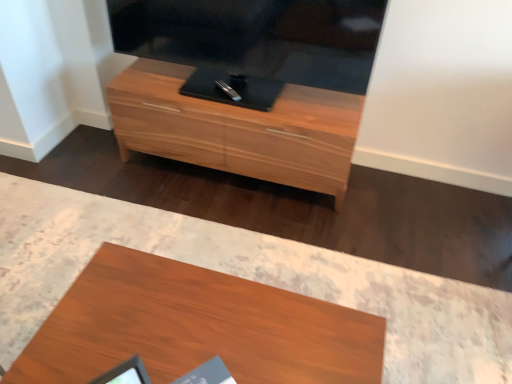
Identify the location of wooden chest of drawers at center. (238, 129).

The width and height of the screenshot is (512, 384). What do you see at coordinates (238, 129) in the screenshot?
I see `wooden chest of drawers at center` at bounding box center [238, 129].

Measure the distance between wooden chest of drawers at center and camera.

The distance of wooden chest of drawers at center from camera is 1.87 meters.

What is the approximate height of wooden desk at center?

wooden desk at center is 41.45 centimeters in height.

The image size is (512, 384). Describe the element at coordinates (196, 327) in the screenshot. I see `wooden desk at center` at that location.

Measure the distance between point (142,273) and camera.

They are 1.28 meters apart.

What are the coordinates of `wooden desk at center` in the screenshot? It's located at (196, 327).

At what (x,y) coordinates should I click in order to perform the action: click on wooden chest of drawers at center. Please return your answer as a coordinate pair (x, y). Looking at the image, I should click on (238, 129).

Which is more to the left, wooden chest of drawers at center or wooden desk at center?

wooden desk at center is more to the left.

Between wooden chest of drawers at center and wooden desk at center, which one is positioned behind?

wooden chest of drawers at center is more distant.

Looking at this image, which is further, (115,83) or (106,243)?

Point (115,83)

From the image's perspective, is wooden chest of drawers at center positioned above or below wooden desk at center?

Based on their image positions, wooden chest of drawers at center is located above wooden desk at center.

From a real-world perspective, is wooden chest of drawers at center below wooden desk at center?

No, from a real-world perspective, wooden chest of drawers at center is not beneath wooden desk at center.

Considering the relative sizes of wooden chest of drawers at center and wooden desk at center in the image provided, is wooden chest of drawers at center wider than wooden desk at center?

Incorrect, the width of wooden chest of drawers at center does not surpass that of wooden desk at center.

Does wooden chest of drawers at center have a greater height compared to wooden desk at center?

Indeed, wooden chest of drawers at center has a greater height compared to wooden desk at center.

Considering the sizes of objects wooden chest of drawers at center and wooden desk at center in the image provided, who is bigger, wooden chest of drawers at center or wooden desk at center?

wooden chest of drawers at center.

Is wooden desk at center located within wooden chest of drawers at center?

Definitely not — wooden desk at center is not inside wooden chest of drawers at center.

Is wooden chest of drawers at center beside wooden desk at center?

wooden chest of drawers at center and wooden desk at center are not in contact.

Is wooden chest of drawers at center positioned with its back to wooden desk at center?

No, wooden chest of drawers at center's orientation is not away from wooden desk at center.

What's the angular difference between wooden chest of drawers at center and wooden desk at center's facing directions?

They differ by 179 degrees in their facing directions.

Measure the distance between wooden chest of drawers at center and wooden desk at center.

A distance of 38.01 inches exists between wooden chest of drawers at center and wooden desk at center.

You are a GUI agent. You are given a task and a screenshot of the screen. Output one action in this format:
    pyautogui.click(x=<x>, y=<y>)
    Task: Click on the chest of drawers located behind the wooden desk at center
    
    Given the screenshot: What is the action you would take?
    pyautogui.click(x=238, y=129)

Visually, is wooden desk at center positioned to the left or to the right of wooden chest of drawers at center?

wooden desk at center is to the left of wooden chest of drawers at center.

Is wooden desk at center behind wooden chest of drawers at center?

No.

Considering the positions of points (260, 317) and (179, 102), is point (260, 317) farther from camera compared to point (179, 102)?

No, (260, 317) is in front of (179, 102).

From the image's perspective, is wooden desk at center under wooden chest of drawers at center?

Yes, from the image's perspective, wooden desk at center is below wooden chest of drawers at center.

From a real-world perspective, between wooden desk at center and wooden chest of drawers at center, who is vertically higher?

From a 3D spatial view, wooden chest of drawers at center is above.

Which object is wider, wooden desk at center or wooden chest of drawers at center?

wooden desk at center.

Who is taller, wooden desk at center or wooden chest of drawers at center?

With more height is wooden chest of drawers at center.

In the scene shown: Is wooden desk at center smaller than wooden chest of drawers at center?

Yes.

Do you think wooden desk at center is within wooden chest of drawers at center, or outside of it?

wooden desk at center is outside wooden chest of drawers at center.

Would you say wooden desk at center is a long distance from wooden chest of drawers at center?

That's not correct — wooden desk at center is a little close to wooden chest of drawers at center.

Could you tell me if wooden desk at center is facing wooden chest of drawers at center?

Yes, wooden desk at center is turned towards wooden chest of drawers at center.

How different are the orientations of wooden desk at center and wooden chest of drawers at center in degrees?

179 degrees.

Where is `desk that is under the wooden chest of drawers at center (from a real-world perspective)`? The image size is (512, 384). desk that is under the wooden chest of drawers at center (from a real-world perspective) is located at coordinates (196, 327).

Identify the location of the chest of drawers lying above the wooden desk at center (from the image's perspective). (238, 129).

You are a GUI agent. You are given a task and a screenshot of the screen. Output one action in this format:
    pyautogui.click(x=<x>, y=<y>)
    Task: Click on the desk located on the left of wooden chest of drawers at center
    The width and height of the screenshot is (512, 384).
    Given the screenshot: What is the action you would take?
    click(196, 327)